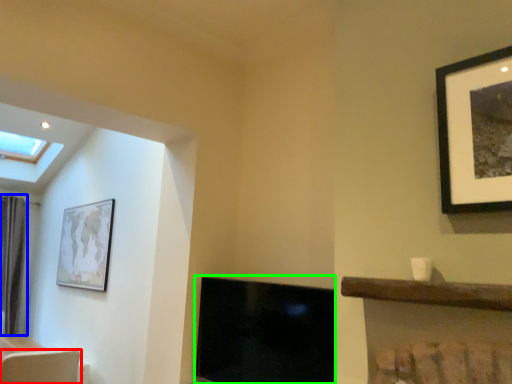
Question: Which object is positioned farthest from swivel chair (highlighted by a red box)? Select from curtain (highlighted by a blue box) and fireplace (highlighted by a green box).

Choices:
 (A) curtain
 (B) fireplace

Answer: (A)